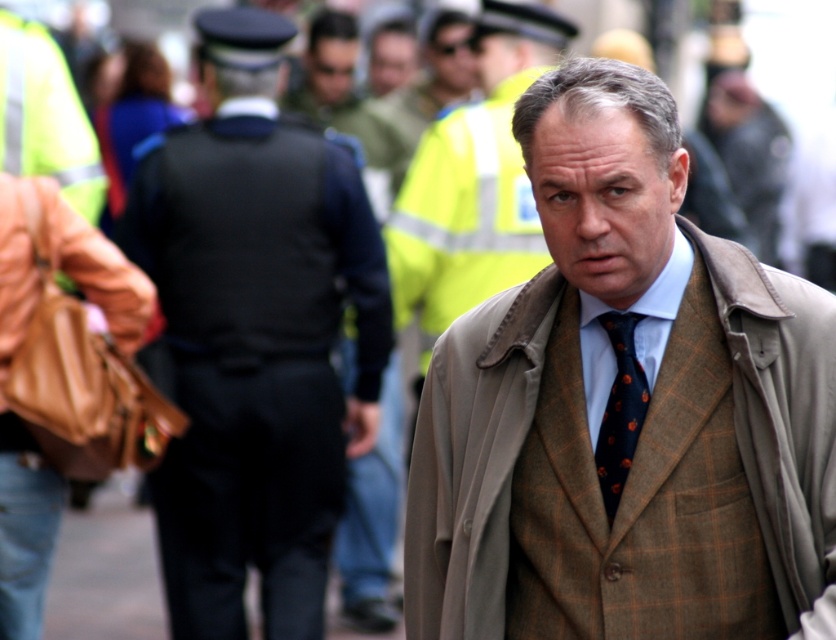
Question: Observing the image, what is the correct spatial positioning of dark blue uniform at center in reference to beige woolen trench coat at center?

Choices:
 (A) right
 (B) left

Answer: (B)

Question: Which point is farther to the camera?

Choices:
 (A) beige woolen trench coat at center
 (B) dark blue uniform at center
 (C) dark blue textured tie at center

Answer: (B)

Question: Is dark blue uniform at center to the left of beige woolen trench coat at center from the viewer's perspective?

Choices:
 (A) no
 (B) yes

Answer: (B)

Question: Among these objects, which one is nearest to the camera?

Choices:
 (A) dark blue textured tie at center
 (B) beige woolen trench coat at center

Answer: (B)

Question: Considering the real-world distances, which object is closest to the dark blue textured tie at center?

Choices:
 (A) beige woolen trench coat at center
 (B) dark blue uniform at center

Answer: (A)

Question: Is dark blue uniform at center above beige woolen trench coat at center?

Choices:
 (A) no
 (B) yes

Answer: (B)